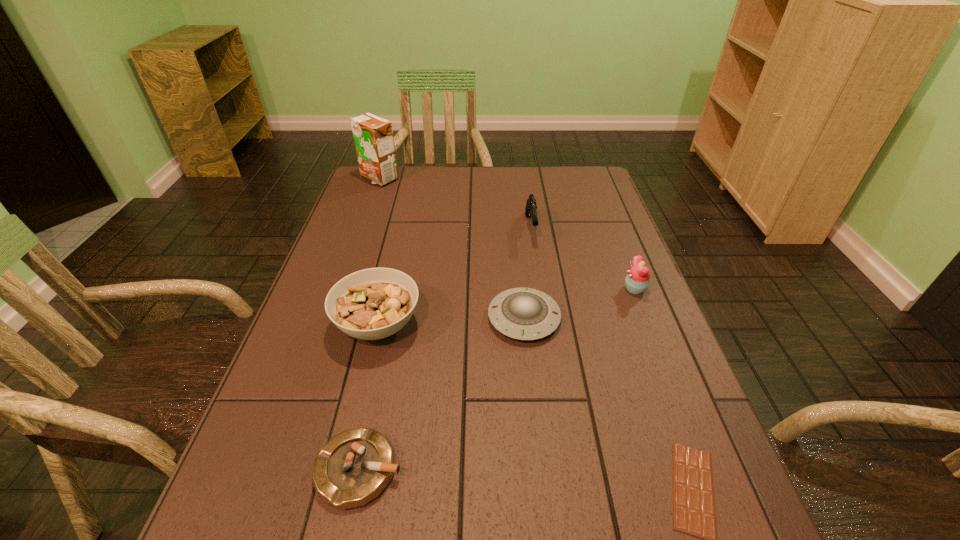
Image resolution: width=960 pixels, height=540 pixels. In order to click on vacant space located on the face of the cupcake in this screenshot , I will do `click(484, 289)`.

The width and height of the screenshot is (960, 540). Identify the location of free location located on the face of the cupcake. (468, 289).

This screenshot has width=960, height=540. In order to click on free spot located on the right of the stew in this screenshot , I will do `click(535, 325)`.

Locate an element on the screen. blank area located 0.050m on the left of the third shortest object is located at coordinates (467, 318).

Where is `free space located 0.380m on the back of the sixth tallest object`? free space located 0.380m on the back of the sixth tallest object is located at coordinates (396, 292).

The image size is (960, 540). In order to click on object located at the far edge in this screenshot , I will do `click(373, 136)`.

Where is `carton that is positioned at the left edge`? The image size is (960, 540). carton that is positioned at the left edge is located at coordinates (373, 136).

Identify the location of stew located in the left edge section of the desktop. (370, 304).

Where is `ashtray that is at the left edge`? The width and height of the screenshot is (960, 540). ashtray that is at the left edge is located at coordinates (353, 468).

Where is `object that is at the right edge`? The height and width of the screenshot is (540, 960). object that is at the right edge is located at coordinates click(637, 280).